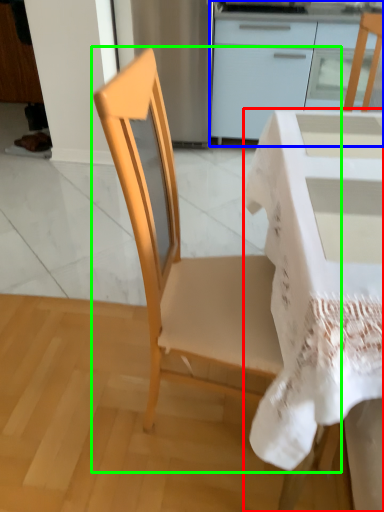
Question: Which is nearer to the desk (highlighted by a red box)? cabinetry (highlighted by a blue box) or chair (highlighted by a green box).

Choices:
 (A) cabinetry
 (B) chair

Answer: (B)